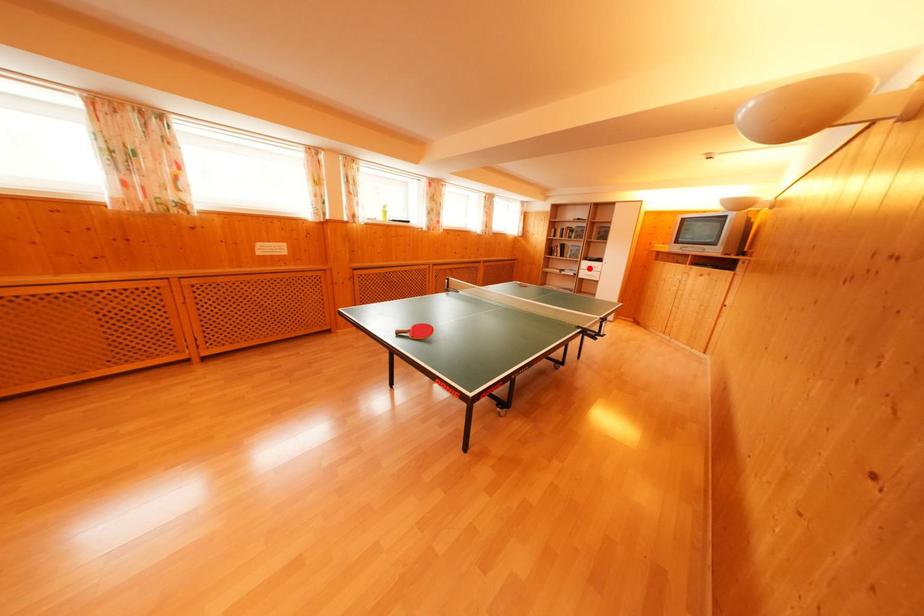
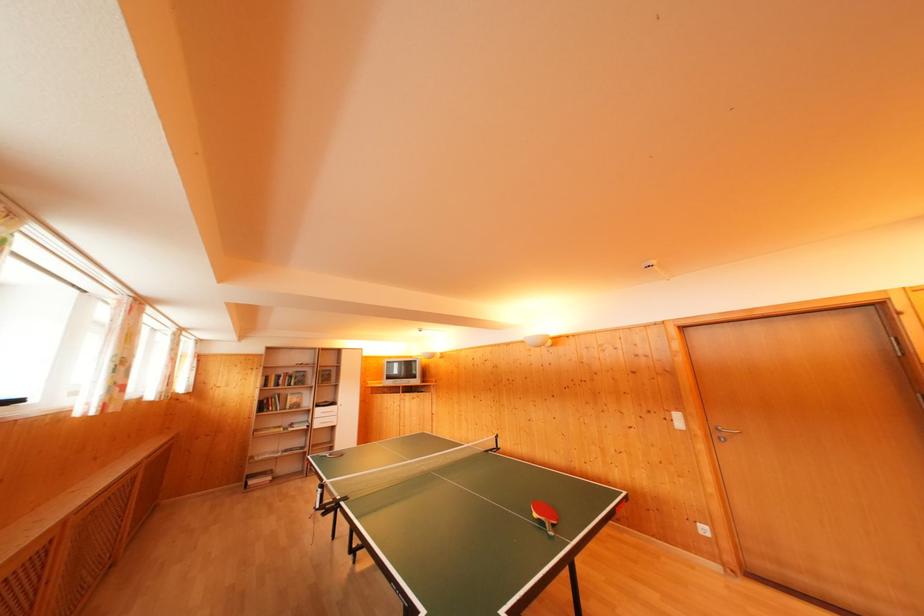
Question: A red point is marked in image1. In image2, is the corresponding 3D point closer to the camera or farther? Reply with the corresponding letter.

Choices:
 (A) The corresponding 3D point is closer.
 (B) The corresponding 3D point is farther.

Answer: (B)